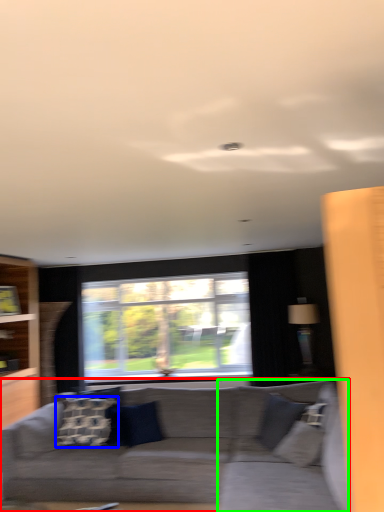
Question: Considering the real-world distances, which object is closest to studio couch (highlighted by a red box)? pillow (highlighted by a blue box) or swivel chair (highlighted by a green box).

Choices:
 (A) pillow
 (B) swivel chair

Answer: (B)